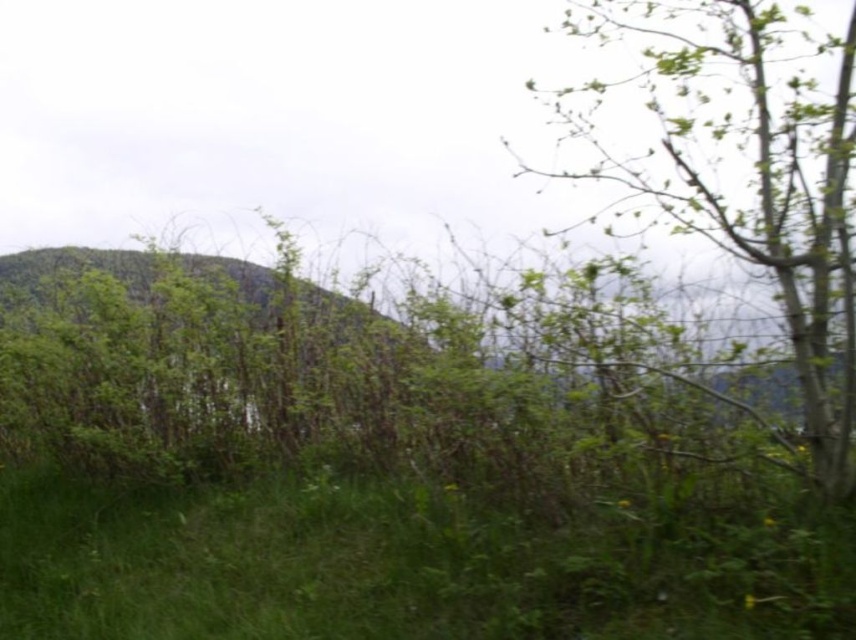
Between point (313, 512) and point (700, 92), which one is positioned behind?

Point (700, 92)

Which of these two, green grassy at center or green leafy tree at upper right, stands taller?

Standing taller between the two is green leafy tree at upper right.

Is point (562, 627) farther from viewer compared to point (777, 122)?

That is False.

The height and width of the screenshot is (640, 856). Find the location of `green grassy at center`. green grassy at center is located at coordinates (405, 564).